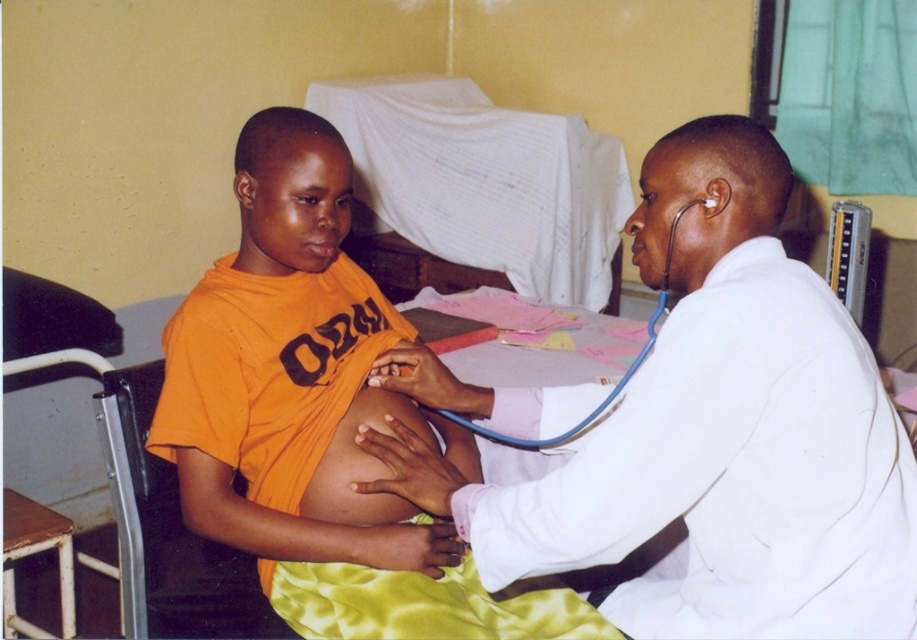
Between orange cotton shirt at center and blue rubber stethoscope at upper right, which one has more height?

Standing taller between the two is orange cotton shirt at center.

Does orange cotton shirt at center appear on the right side of blue rubber stethoscope at upper right?

In fact, orange cotton shirt at center is to the left of blue rubber stethoscope at upper right.

Where is `orange cotton shirt at center`? orange cotton shirt at center is located at coordinates (318, 419).

Does white smooth coat at upper right have a lesser height compared to orange cotton shirt at center?

Yes, white smooth coat at upper right is shorter than orange cotton shirt at center.

Which is below, white smooth coat at upper right or orange cotton shirt at center?

white smooth coat at upper right is below.

What do you see at coordinates (715, 433) in the screenshot? This screenshot has height=640, width=917. I see `white smooth coat at upper right` at bounding box center [715, 433].

At what (x,y) coordinates should I click in order to perform the action: click on white smooth coat at upper right. Please return your answer as a coordinate pair (x, y). The width and height of the screenshot is (917, 640). Looking at the image, I should click on (715, 433).

Does white smooth coat at upper right lie behind blue rubber stethoscope at upper right?

That is False.

Is point (658, 372) farther from camera compared to point (539, 444)?

That is False.

Identify the location of white smooth coat at upper right. This screenshot has height=640, width=917. (715, 433).